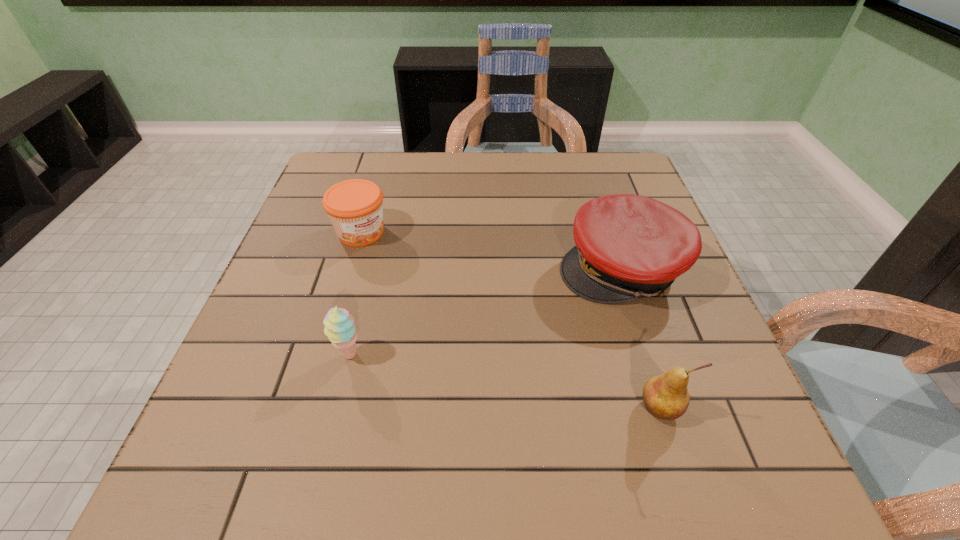
Find the location of a particular element. vacant region located on the front of the cap with an emblem is located at coordinates (474, 360).

Locate an element on the screen. The height and width of the screenshot is (540, 960). free space located 0.070m on the front of the cap with an emblem is located at coordinates (553, 310).

In order to click on object that is at the near edge in this screenshot , I will do `click(666, 397)`.

Identify the location of object present at the left edge. Image resolution: width=960 pixels, height=540 pixels. (355, 207).

Where is `pear that is positioned at the right edge`? The width and height of the screenshot is (960, 540). pear that is positioned at the right edge is located at coordinates (666, 397).

Where is `cap at the right edge`? The height and width of the screenshot is (540, 960). cap at the right edge is located at coordinates click(628, 246).

This screenshot has width=960, height=540. Identify the location of object that is at the near right corner. (666, 397).

In the image, there is a desktop. In order to click on vacant space at the far edge in this screenshot , I will do `click(572, 153)`.

Image resolution: width=960 pixels, height=540 pixels. I want to click on vacant space at the near edge, so click(x=637, y=399).

In the image, there is a desktop. At what (x,y) coordinates should I click in order to perform the action: click on vacant space at the right edge. Please return your answer as a coordinate pair (x, y). This screenshot has width=960, height=540. Looking at the image, I should click on (682, 300).